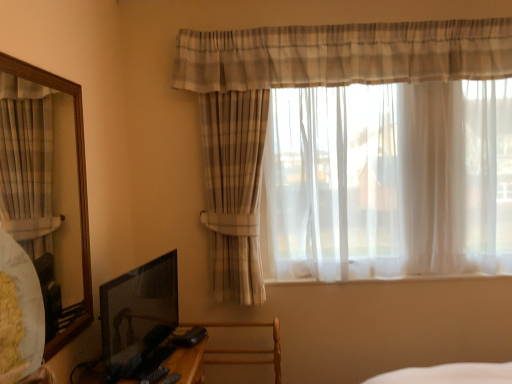
Question: Is wooden swivel chair at lower center shorter than wooden mirror at left?

Choices:
 (A) yes
 (B) no

Answer: (A)

Question: Is wooden swivel chair at lower center facing towards wooden mirror at left?

Choices:
 (A) yes
 (B) no

Answer: (B)

Question: Does wooden swivel chair at lower center have a smaller size compared to wooden mirror at left?

Choices:
 (A) no
 (B) yes

Answer: (A)

Question: Is wooden swivel chair at lower center oriented away from wooden mirror at left?

Choices:
 (A) no
 (B) yes

Answer: (A)

Question: Does wooden swivel chair at lower center have a lesser width compared to wooden mirror at left?

Choices:
 (A) no
 (B) yes

Answer: (A)

Question: From a real-world perspective, is wooden swivel chair at lower center located beneath wooden mirror at left?

Choices:
 (A) yes
 (B) no

Answer: (A)

Question: From a real-world perspective, is matte black tv at lower left positioned over plaid sheer curtain at upper center based on gravity?

Choices:
 (A) no
 (B) yes

Answer: (A)

Question: Considering the relative sizes of matte black tv at lower left and plaid sheer curtain at upper center in the image provided, is matte black tv at lower left shorter than plaid sheer curtain at upper center?

Choices:
 (A) yes
 (B) no

Answer: (A)

Question: Is matte black tv at lower left positioned with its back to plaid sheer curtain at upper center?

Choices:
 (A) yes
 (B) no

Answer: (B)

Question: Is the depth of matte black tv at lower left greater than that of plaid sheer curtain at upper center?

Choices:
 (A) yes
 (B) no

Answer: (B)

Question: Is matte black tv at lower left oriented towards plaid sheer curtain at upper center?

Choices:
 (A) yes
 (B) no

Answer: (B)

Question: Is matte black tv at lower left closer to camera compared to plaid sheer curtain at upper center?

Choices:
 (A) yes
 (B) no

Answer: (A)

Question: Is matte black tv at lower left at the right side of wooden swivel chair at lower center?

Choices:
 (A) no
 (B) yes

Answer: (A)